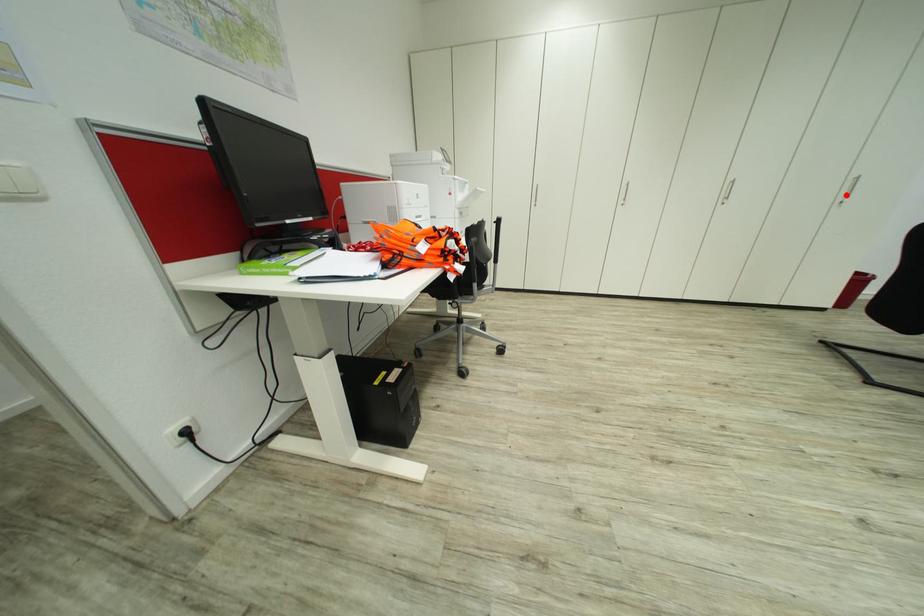
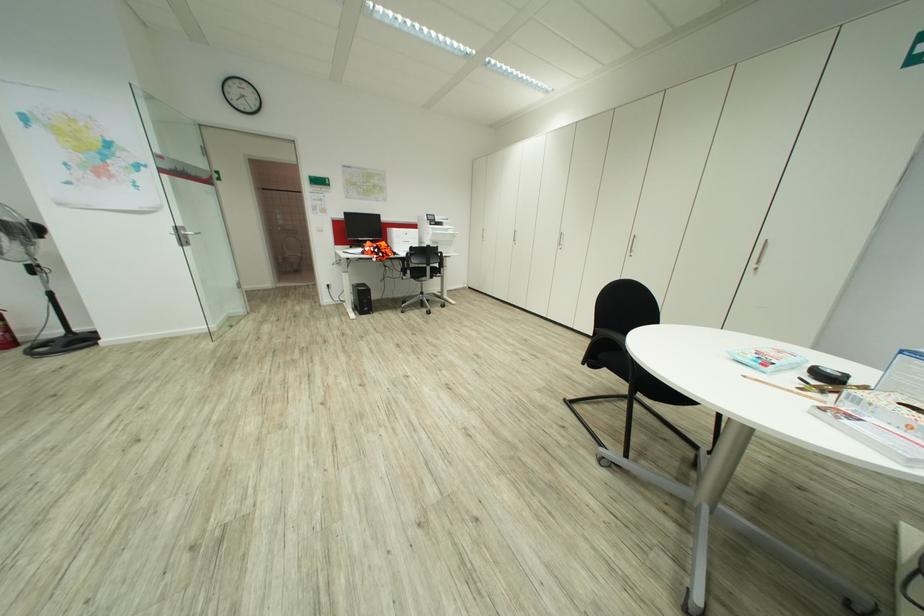
In the second image, find the point that corresponds to the highlighted location in the first image.

(758, 262)